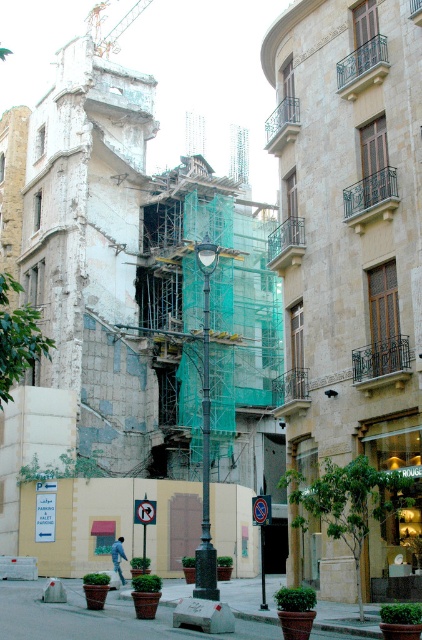
Based on the photo, measure the distance between point (202, 566) and camera.

The distance of point (202, 566) from camera is 128.30 feet.

Describe the element at coordinates (205, 476) in the screenshot. I see `green painted metal pole at center` at that location.

Is point (207, 394) positioned before point (119, 540)?

Yes, point (207, 394) is closer to viewer.

What are the coordinates of `green painted metal pole at center` in the screenshot? It's located at (205, 476).